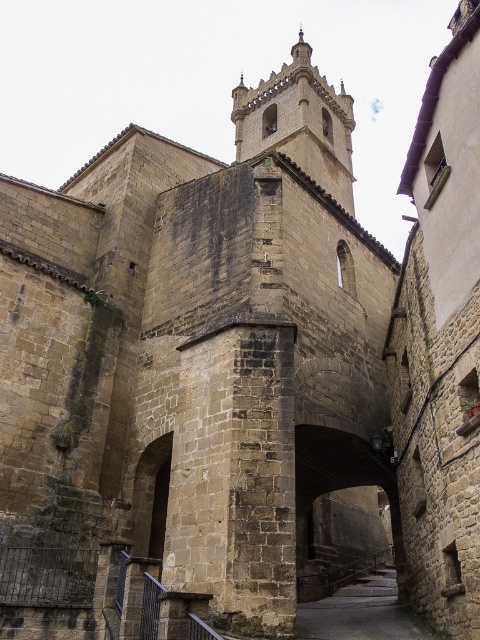
Does brown stone tower at center appear over dark stone archway at center?

Yes.

Consider the image. Does brown stone tower at center have a greater height compared to dark stone archway at center?

Indeed, brown stone tower at center has a greater height compared to dark stone archway at center.

Is point (321, 156) positioned behind point (305, 516)?

That is True.

Image resolution: width=480 pixels, height=640 pixels. What are the coordinates of `brown stone tower at center` in the screenshot? It's located at (299, 122).

Consider the image. Does brown stone tower at center appear under stone paved alley at center?

Actually, brown stone tower at center is above stone paved alley at center.

Which is more to the left, brown stone tower at center or stone paved alley at center?

stone paved alley at center

Between point (303, 166) and point (335, 595), which one is positioned in front?

Point (335, 595) is in front.

Identify the location of brown stone tower at center. (299, 122).

Does stone paved alley at center appear on the left side of dark stone archway at center?

Incorrect, stone paved alley at center is not on the left side of dark stone archway at center.

Is stone paved alley at center wider than dark stone archway at center?

Yes.

Who is more forward, (339, 634) or (300, 561)?

Point (339, 634)

The width and height of the screenshot is (480, 640). Find the location of `stone paved alley at center`. stone paved alley at center is located at coordinates (361, 612).